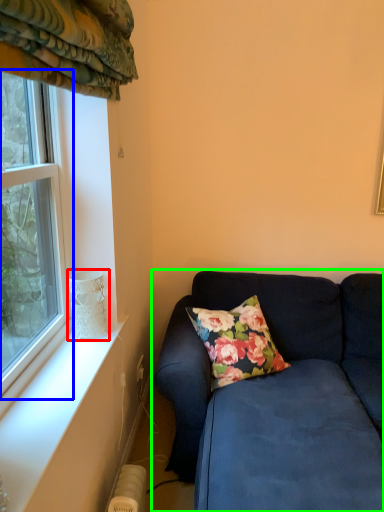
Question: Which object is the closest to the glass vase (highlighted by a red box)? Choose among these: window (highlighted by a blue box) or studio couch (highlighted by a green box).

Choices:
 (A) window
 (B) studio couch

Answer: (A)